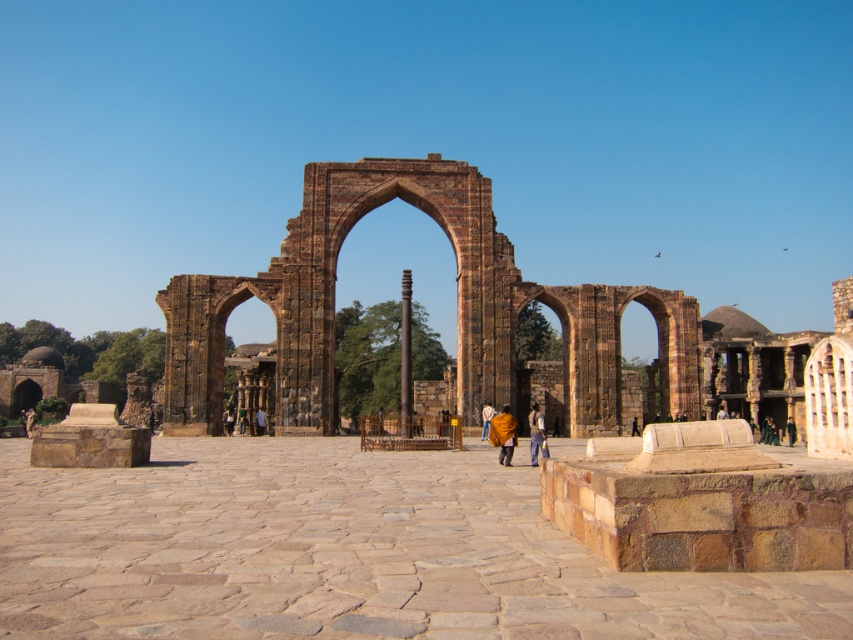
Question: Which point is farther to the camera?

Choices:
 (A) (694, 417)
 (B) (529, 419)
 (C) (631, 426)
 (D) (512, 417)

Answer: (A)

Question: Where is orange fabric person at center located in relation to dark brown leather pants at center in the image?

Choices:
 (A) above
 (B) below

Answer: (A)

Question: Which object is closer to the camera taking this photo?

Choices:
 (A) blue fabric person at center
 (B) denim jacket at center

Answer: (B)

Question: Is brown stone pillar at center positioned at the back of dark blue fabric at center?

Choices:
 (A) no
 (B) yes

Answer: (A)

Question: Is blue fabric person at center positioned behind dark blue fabric at center?

Choices:
 (A) no
 (B) yes

Answer: (B)

Question: Considering the real-world distances, which object is farthest from the dark brown leather pants at center?

Choices:
 (A) blue fabric person at center
 (B) orange fabric person at center
 (C) brown stone arch at center

Answer: (A)